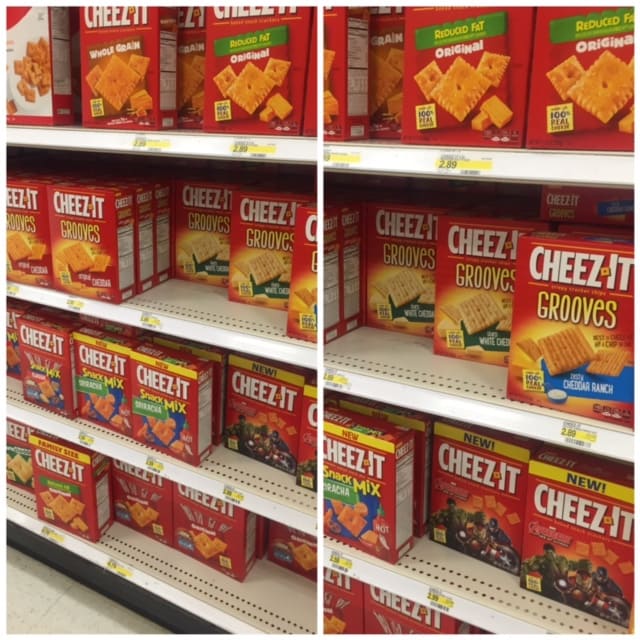
Can you point out all top shelf boxes of cheez- its in this image? Your answer should be formatted as a list of tuples, i.e. [(x1, y1), (x2, y2), ...], where each tuple contains the x and y coordinates of a point satisfying the conditions above.

[(45, 84), (118, 84), (187, 84), (234, 84), (342, 81), (384, 82), (491, 93), (580, 99)]